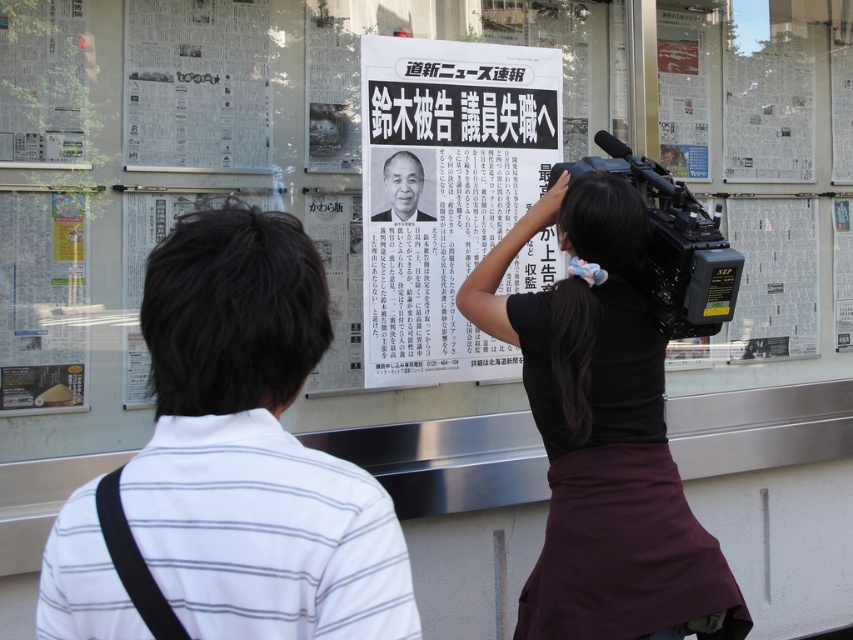
Which of these two, black paper at center or white paper poster at upper left, stands taller?

Standing taller between the two is black paper at center.

This screenshot has height=640, width=853. What do you see at coordinates (445, 193) in the screenshot?
I see `black paper at center` at bounding box center [445, 193].

Identify the location of black paper at center. The width and height of the screenshot is (853, 640). (445, 193).

Between point (183, 576) and point (421, 218), which one is positioned in front?

Point (183, 576) is in front.

Does point (320, 609) lie behind point (386, 168)?

No, it is not.

Find the location of a particular element. Image resolution: width=853 pixels, height=640 pixels. white striped shirt at center is located at coordinates (253, 448).

Is white paper poster at upper left to the left of black plastic video camera at center from the viewer's perspective?

Yes, white paper poster at upper left is to the left of black plastic video camera at center.

Image resolution: width=853 pixels, height=640 pixels. I want to click on white paper poster at upper left, so click(x=196, y=84).

This screenshot has height=640, width=853. Identify the location of white paper poster at upper left. (196, 84).